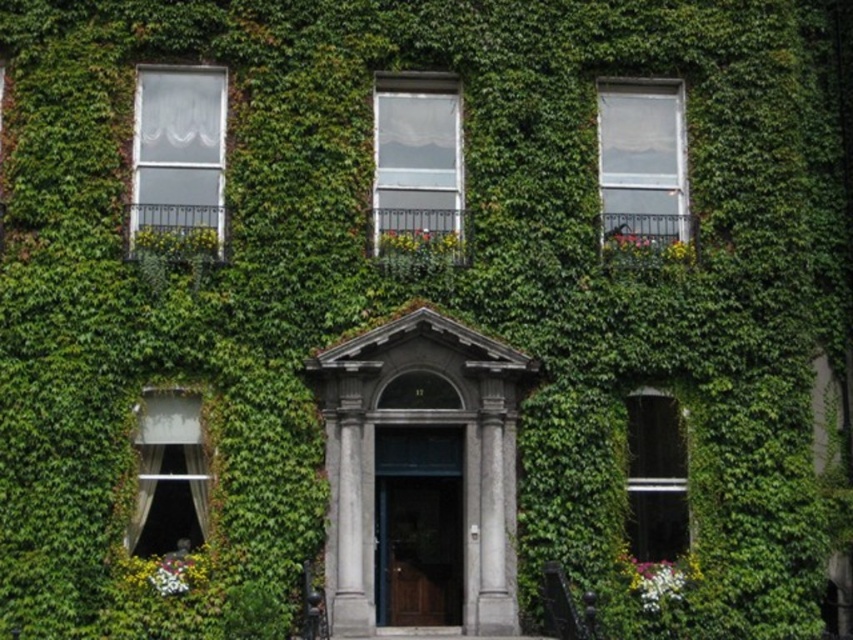
You are standing in front of the ivy covered building and want to know which of the two points, point (415,230) or point (672,96), is closer to you. Can you determine this based on their positions?

Point (415,230) is closer to the camera than point (672,96), so it is closer to you.

You are standing at the entrance of the building and want to walk towards the point labeled as point (154, 445). Which direction should you move relative to the point labeled as point (450, 253)?

Since point (450, 253) is behind point (154, 445), you should move towards the direction of point (154, 445), which is in front of point (450, 253) from your current position at the entrance.